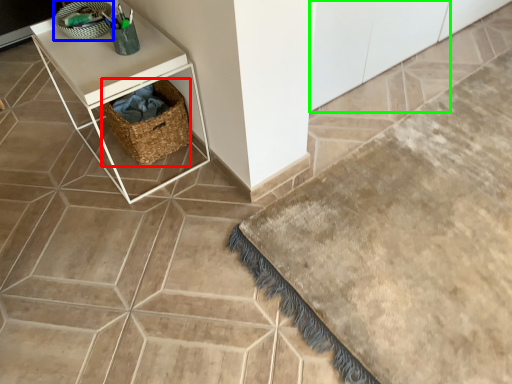
Question: Estimate the real-world distances between objects in this image. Which object is closer to basket (highlighted by a red box), basket (highlighted by a blue box) or cabinetry (highlighted by a green box)?

Choices:
 (A) basket
 (B) cabinetry

Answer: (A)